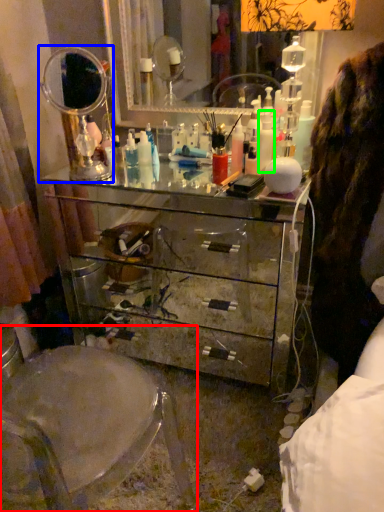
Question: Considering the real-world distances, which object is closest to swivel chair (highlighted by a red box)? mirror (highlighted by a blue box) or toiletry (highlighted by a green box).

Choices:
 (A) mirror
 (B) toiletry

Answer: (A)